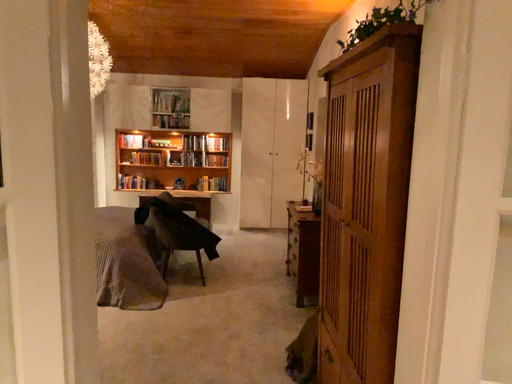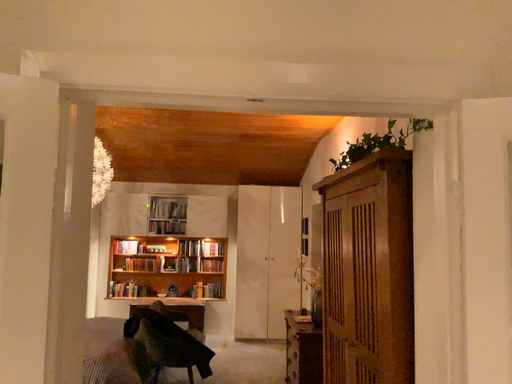
Question: How did the camera likely rotate when shooting the video?

Choices:
 (A) rotated downward
 (B) rotated upward

Answer: (B)